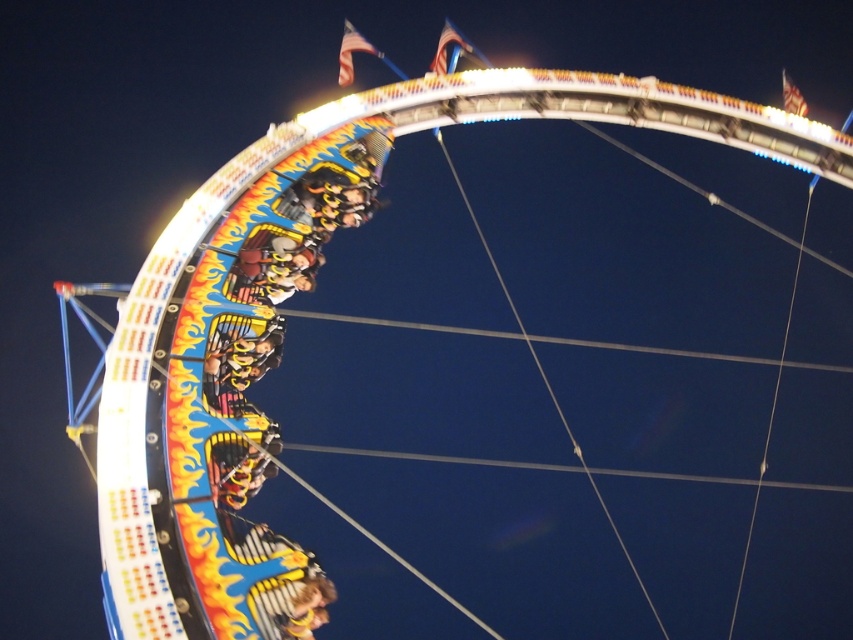
Which is in front, point (215, 240) or point (311, 604)?

Point (311, 604) is in front.

Which is behind, point (257, 529) or point (277, 534)?

The point (257, 529) is behind.

Is point (257, 440) less distant than point (260, 563)?

No, (257, 440) is further to viewer.

Find the location of a particular element. Image resolution: width=853 pixels, height=640 pixels. metallic yellow roller coaster car at center is located at coordinates (273, 294).